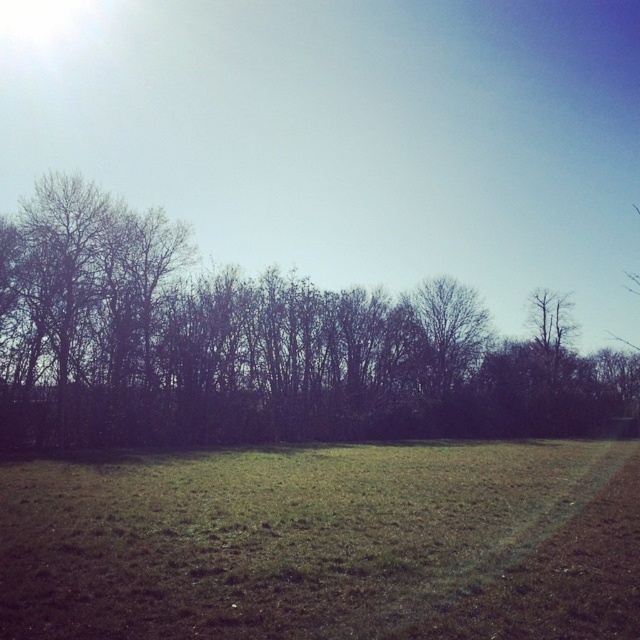
Consider the image. You are a gardener planning to mow the lawn. You see the green grass at center and the dark brown leafless trees at center in the scene. Which object would require less time to mow, and why?

The green grass at center would require less time to mow because it has a smaller size compared to the dark brown leafless trees at center.

You are standing in the middle of the scene and want to walk towards the dark brown leafless trees at center. Which direction should you walk to avoid stepping on the green grass at center?

The green grass at center is to the left of dark brown leafless trees at center. To avoid stepping on the green grass at center, you should walk to the right side of the dark brown leafless trees at center.

You are standing at the center of the image and want to step onto the green grass at center. Which direction should you move to reach it?

Since the green grass at center is located at point coordinates of (x=324, y=544), you should move forward to reach it as it is directly ahead in the center of your view.